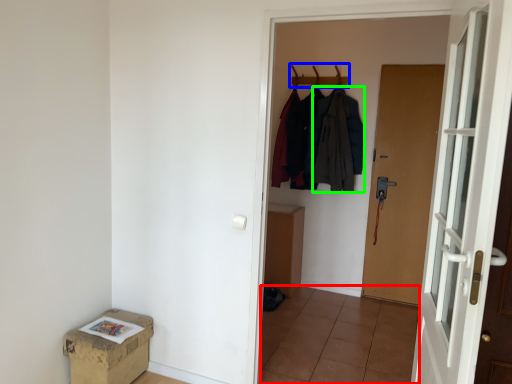
Question: Considering the real-world distances, which object is farthest from tile (highlighted by a red box)? hanger (highlighted by a blue box) or clothing (highlighted by a green box)?

Choices:
 (A) hanger
 (B) clothing

Answer: (A)